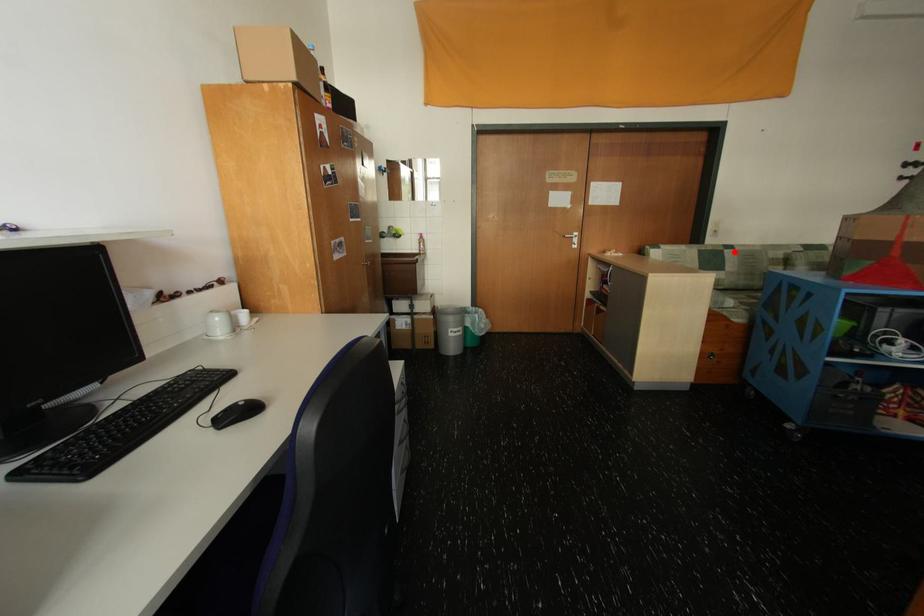
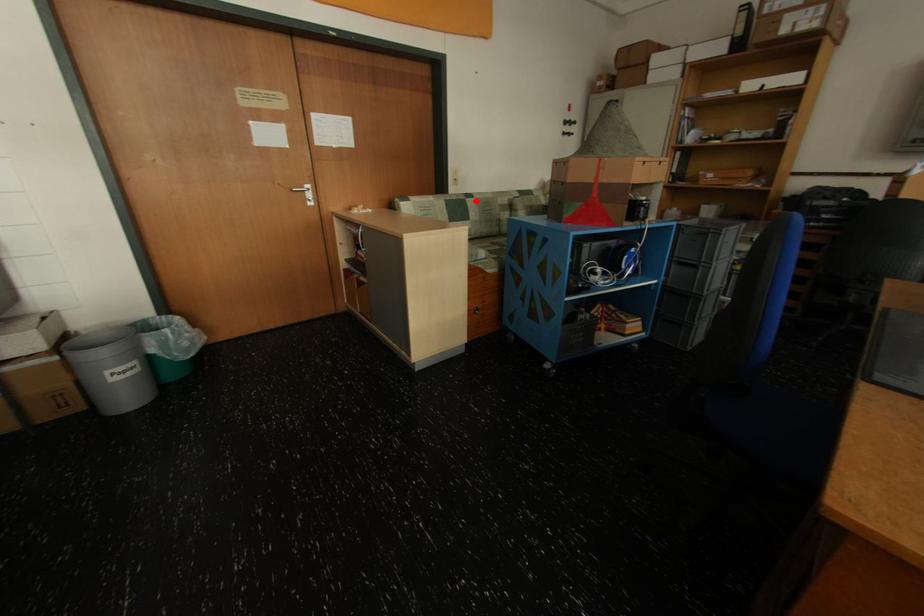
I am providing you with two images of the same scene from different viewpoints. A red point is marked on the first image and another point is marked on the second image. Are the points marked in image1 and image2 representing the same 3D position?

Yes